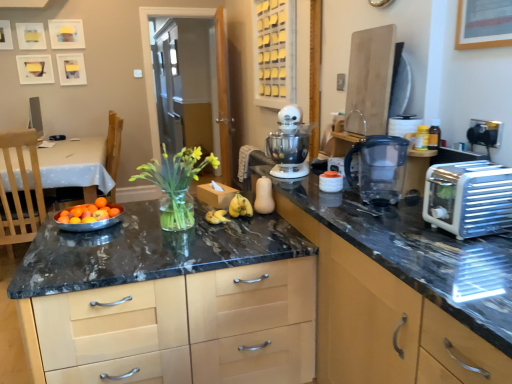
At what (x,y) coordinates should I click in order to perform the action: click on vacant space in front of translucent glass vase at center. Please return your answer as a coordinate pair (x, y). This screenshot has height=384, width=512. Looking at the image, I should click on (160, 242).